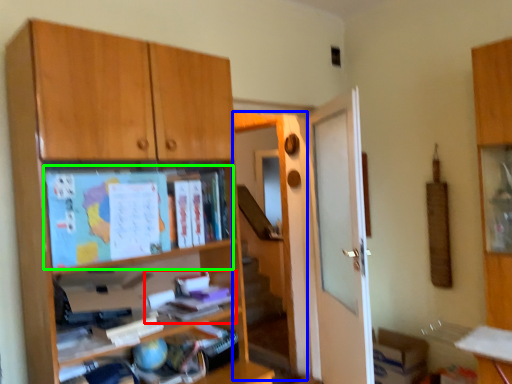
Question: Considering the real-world distances, which object is closest to book (highlighted by a red box)? screen door (highlighted by a blue box) or paperback book (highlighted by a green box).

Choices:
 (A) screen door
 (B) paperback book

Answer: (B)